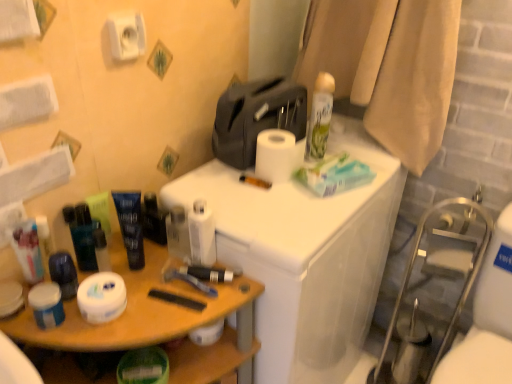
Find the location of a particular element. free spot above white plastic toilet at upper right, which ranks as the 1th counter in right-to-left order (from a real-world perspective) is located at coordinates (282, 193).